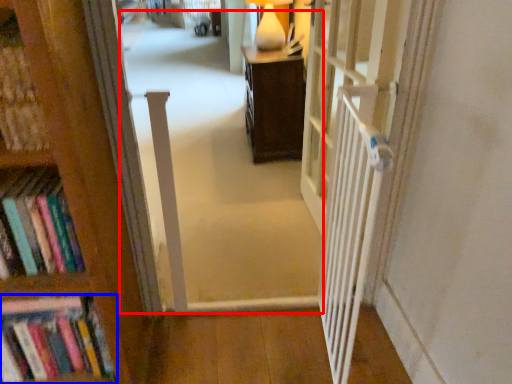
Question: Which point is further to the camera, corridor (highlighted by a red box) or book (highlighted by a blue box)?

Choices:
 (A) corridor
 (B) book

Answer: (A)